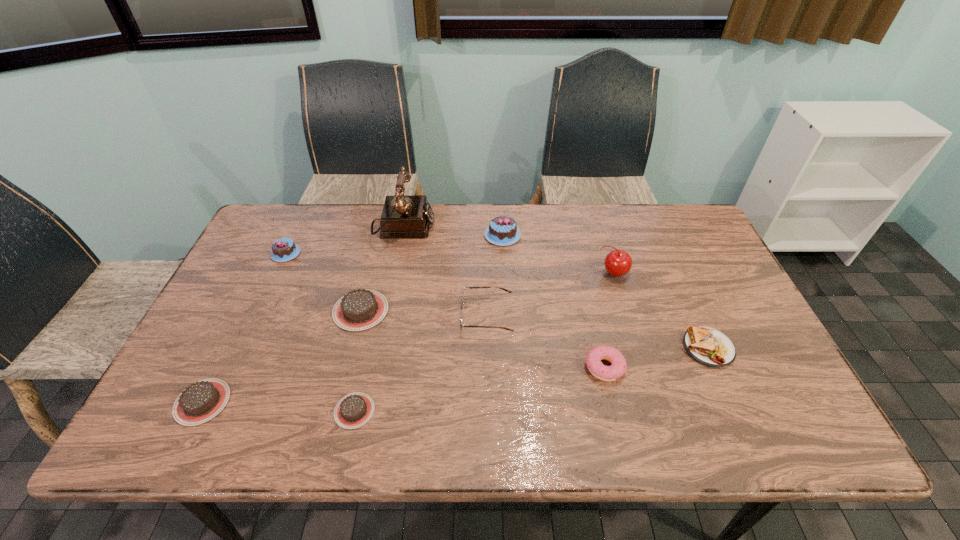
At what (x,y) coordinates should I click in order to perform the action: click on the tallest object. Please return your answer as a coordinate pair (x, y). The width and height of the screenshot is (960, 540). Looking at the image, I should click on (403, 216).

The image size is (960, 540). I want to click on brown telephone, so click(x=403, y=216).

At what (x,y) coordinates should I click in order to perform the action: click on cherry. Please return your answer as a coordinate pair (x, y). The height and width of the screenshot is (540, 960). Looking at the image, I should click on (617, 263).

The height and width of the screenshot is (540, 960). In order to click on the seventh nearest object in this screenshot , I will do pos(617,263).

Locate an element on the screen. This screenshot has height=540, width=960. the tallest chocolate cake is located at coordinates (502, 230).

The height and width of the screenshot is (540, 960). Identify the location of the rightmost chocolate cake. (502, 230).

I want to click on the fourth shortest chocolate cake, so click(285, 249).

The image size is (960, 540). In order to click on the smaller pink chocolate cake in this screenshot , I will do tap(285, 249).

Locate an element on the screen. The width and height of the screenshot is (960, 540). brown spectacles is located at coordinates pyautogui.click(x=461, y=307).

The height and width of the screenshot is (540, 960). What are the coordinates of `the third farthest chocolate cake` in the screenshot? It's located at (360, 309).